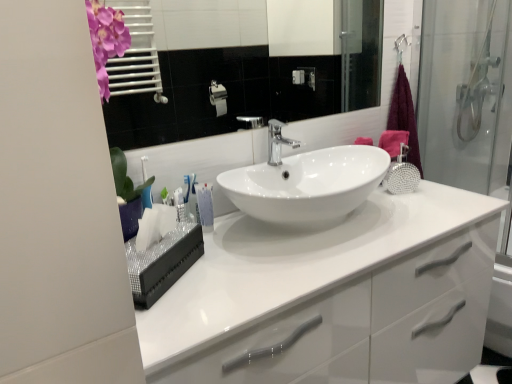
Question: Is the depth of white glossy mirror at upper center greater than that of polished chrome tap at center?

Choices:
 (A) yes
 (B) no

Answer: (B)

Question: Is white glossy mirror at upper center outside of polished chrome tap at center?

Choices:
 (A) yes
 (B) no

Answer: (A)

Question: Is polished chrome tap at center a part of white glossy mirror at upper center?

Choices:
 (A) no
 (B) yes

Answer: (A)

Question: Considering the relative sizes of white glossy mirror at upper center and polished chrome tap at center in the image provided, is white glossy mirror at upper center taller than polished chrome tap at center?

Choices:
 (A) yes
 (B) no

Answer: (A)

Question: Is white glossy mirror at upper center thinner than polished chrome tap at center?

Choices:
 (A) yes
 (B) no

Answer: (A)

Question: In terms of height, does purple fabric towel at right look taller or shorter compared to white glossy tube at center?

Choices:
 (A) short
 (B) tall

Answer: (B)

Question: From the image's perspective, is purple fabric towel at right above or below white glossy tube at center?

Choices:
 (A) below
 (B) above

Answer: (B)

Question: From a real-world perspective, is purple fabric towel at right positioned above or below white glossy tube at center?

Choices:
 (A) below
 (B) above

Answer: (B)

Question: Relative to white glossy tube at center, is purple fabric towel at right in front or behind?

Choices:
 (A) front
 (B) behind

Answer: (B)

Question: Is polished chrome tap at center bigger or smaller than purple fabric towel at right?

Choices:
 (A) small
 (B) big

Answer: (A)

Question: From a real-world perspective, relative to purple fabric towel at right, is polished chrome tap at center vertically above or below?

Choices:
 (A) below
 (B) above

Answer: (B)

Question: From their relative heights in the image, would you say polished chrome tap at center is taller or shorter than purple fabric towel at right?

Choices:
 (A) tall
 (B) short

Answer: (B)

Question: From the image's perspective, is polished chrome tap at center located above or below purple fabric towel at right?

Choices:
 (A) above
 (B) below

Answer: (B)

Question: Is point (418, 168) positioned closer to the camera than point (374, 349)?

Choices:
 (A) farther
 (B) closer

Answer: (A)

Question: Based on their positions, is purple fabric towel at right located to the left or right of white glossy cabinet at center?

Choices:
 (A) left
 (B) right

Answer: (B)